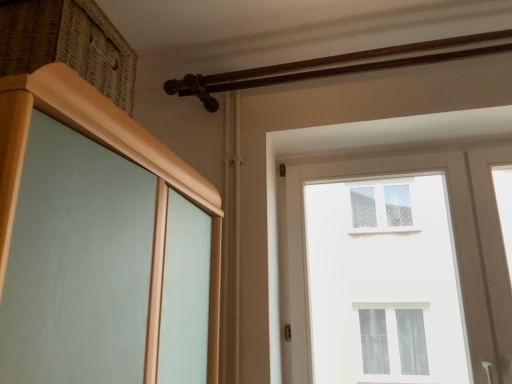
Question: Is woven wood drawer at upper left taller or shorter than white glass window at upper center?

Choices:
 (A) tall
 (B) short

Answer: (B)

Question: Considering the positions of woven wood drawer at upper left and white glass window at upper center in the image, is woven wood drawer at upper left wider or thinner than white glass window at upper center?

Choices:
 (A) wide
 (B) thin

Answer: (A)

Question: Which of these objects is positioned closest to the woven wood drawer at upper left?

Choices:
 (A) white glass window at upper center
 (B) brown wooden rail at upper center

Answer: (B)

Question: Which of these objects is positioned closest to the woven wood drawer at upper left?

Choices:
 (A) brown wooden rail at upper center
 (B) white glass window at upper center

Answer: (A)